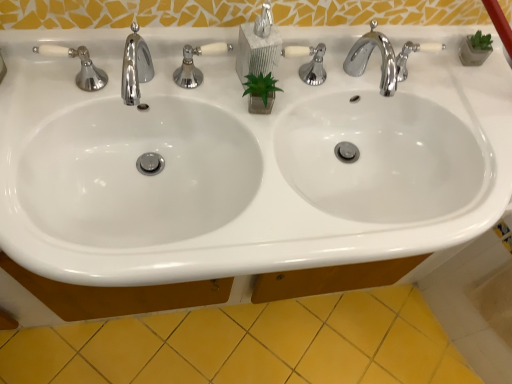
The width and height of the screenshot is (512, 384). What are the coordinates of `vacant point to the left of polished chrome faucet at upper left, the 1th tap positioned from the left` in the screenshot? It's located at (66, 94).